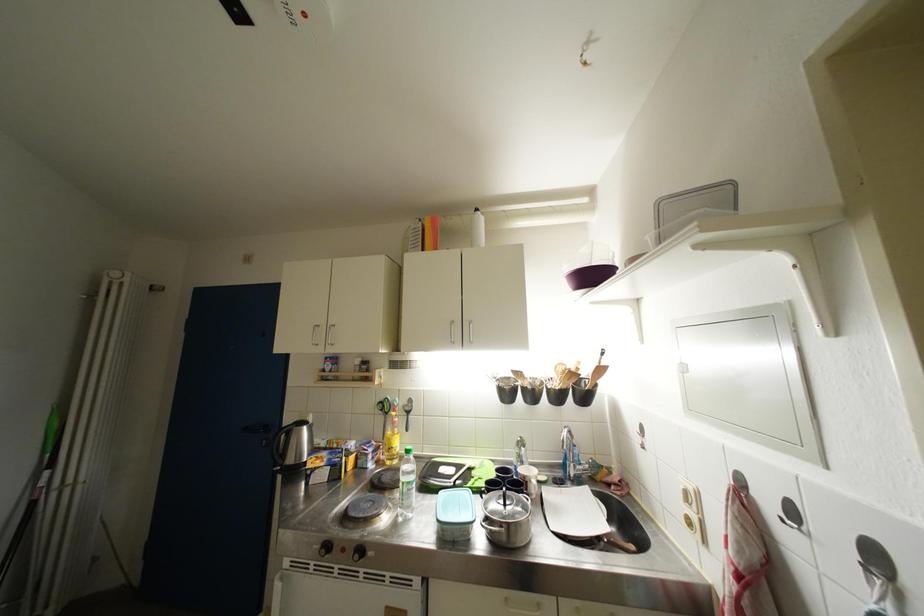
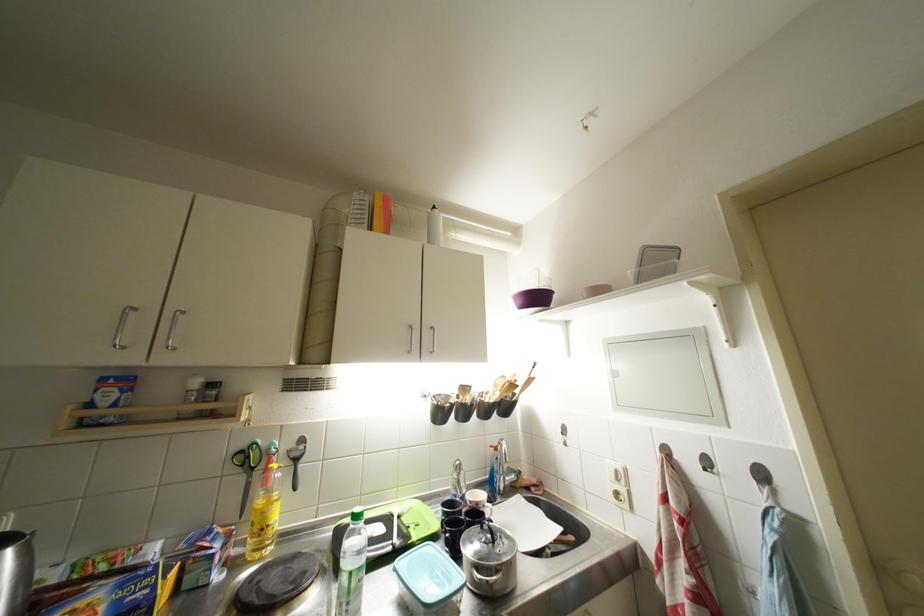
Question: The images are taken continuously from a first-person perspective. In which direction is your viewpoint rotating?

Choices:
 (A) Left
 (B) Right
 (C) Up
 (D) Down

Answer: (B)